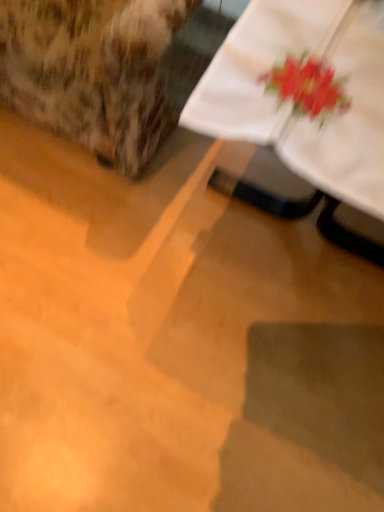
Question: From the image's perspective, is white cloth at upper right positioned above or below floral fabric armchair at upper left?

Choices:
 (A) above
 (B) below

Answer: (B)

Question: Considering the positions of point 248,52 and point 167,12, is point 248,52 closer or farther from the camera than point 167,12?

Choices:
 (A) farther
 (B) closer

Answer: (B)

Question: In terms of height, does white cloth at upper right look taller or shorter compared to floral fabric armchair at upper left?

Choices:
 (A) tall
 (B) short

Answer: (B)

Question: Is floral fabric armchair at upper left bigger or smaller than white cloth at upper right?

Choices:
 (A) big
 (B) small

Answer: (A)

Question: Considering their positions, is floral fabric armchair at upper left located in front of or behind white cloth at upper right?

Choices:
 (A) front
 (B) behind

Answer: (B)

Question: From a real-world perspective, is floral fabric armchair at upper left above or below white cloth at upper right?

Choices:
 (A) below
 (B) above

Answer: (B)

Question: Considering the relative positions of floral fabric armchair at upper left and white cloth at upper right in the image provided, is floral fabric armchair at upper left to the left or to the right of white cloth at upper right?

Choices:
 (A) right
 (B) left

Answer: (B)